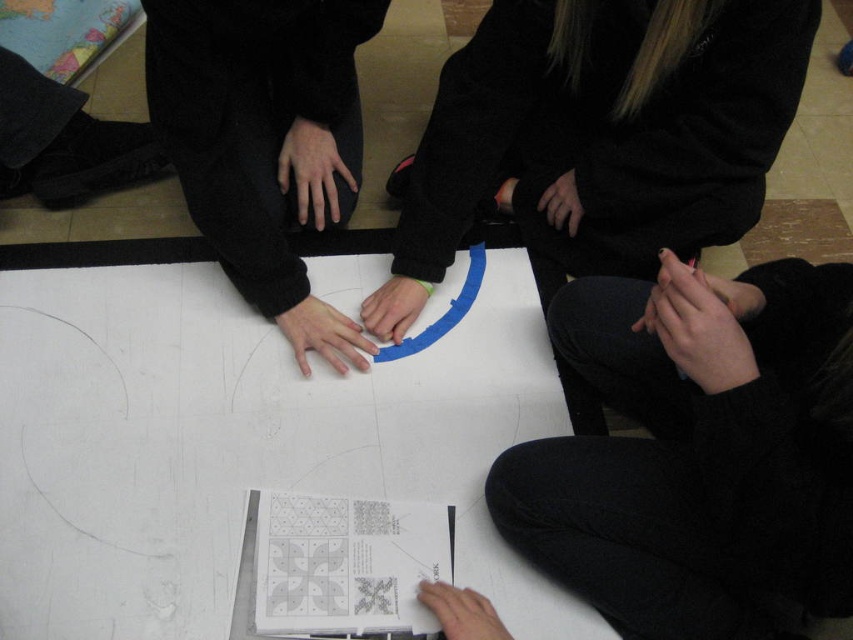
Looking at this image, you are a participant in the activity and need to place a sticker on the white sheet. You have to choose between placing it at point A, which is at point (743, 307), or point B, which is at point (566, 211). Which point is closer to you?

Point A, which is at point (743, 307), is closer to you than point B, which is at point (566, 211).

You are standing at the origin point of the coordinate system in the image. You want to place a small sticker exactly where the black fleece at center is located. What are the coordinates where you should place the sticker?

The coordinates for placing the sticker should be at point (607, 125) since that is the 2D location of the black fleece at center.